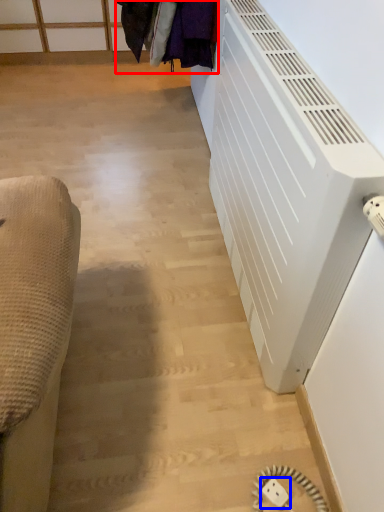
Question: Which object appears farthest to the camera in this image, laundry (highlighted by a red box) or electric outlet (highlighted by a blue box)?

Choices:
 (A) laundry
 (B) electric outlet

Answer: (A)